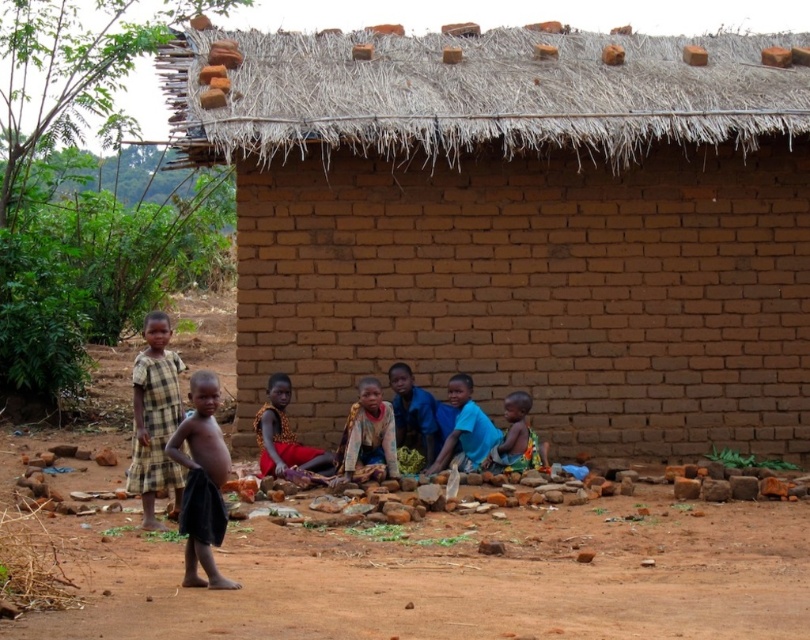
Question: Considering the real-world distances, which object is farthest from the blue fabric at center?

Choices:
 (A) blue fabric cloth at lower center
 (B) thatched straw roof at upper center
 (C) black cloth at left
 (D) blue fabric shirt at center

Answer: (C)

Question: Which point is farther to the camera?

Choices:
 (A) (391, 451)
 (B) (761, 397)

Answer: (B)

Question: Which object appears farthest from the camera in this image?

Choices:
 (A) black cloth at left
 (B) blue fabric cloth at center

Answer: (B)

Question: Considering the relative positions of brown dirt field at lower center and thatched straw roof at upper center in the image provided, where is brown dirt field at lower center located with respect to thatched straw roof at upper center?

Choices:
 (A) right
 (B) left

Answer: (B)

Question: Can you confirm if brown dirt field at lower center is smaller than blue fabric shirt at center?

Choices:
 (A) no
 (B) yes

Answer: (B)

Question: Is brown dirt field at lower center above blue fabric cloth at lower center?

Choices:
 (A) yes
 (B) no

Answer: (B)